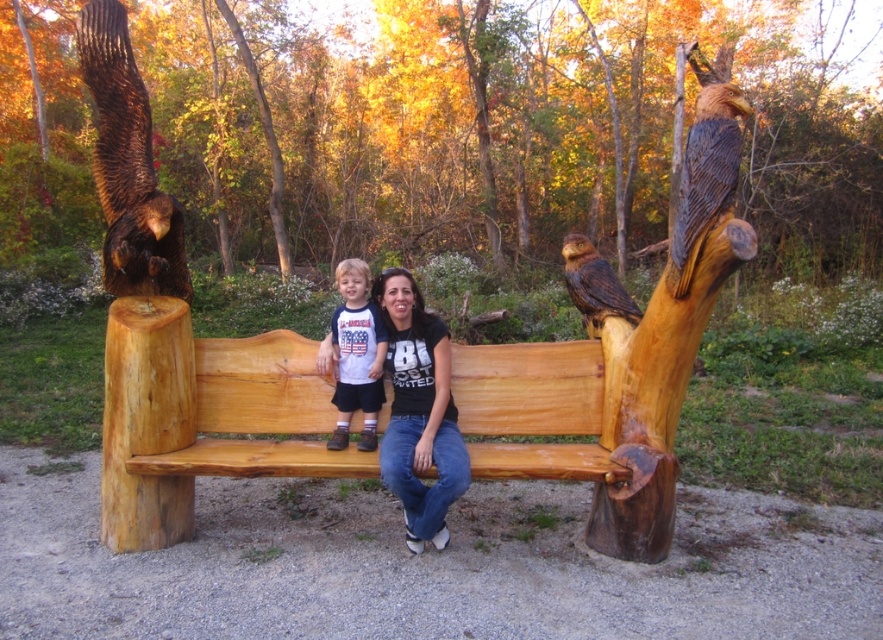
You are a photographer carrying a camera bag that is 90 centimeters long. You are standing at the edge of the park and see the natural wood bench at center and the matte white shirt at center. Can your camera bag fit between them without bending?

A: The natural wood bench at center and the matte white shirt at center are 96.92 centimeters apart from each other. Since your camera bag is 90 centimeters long, it can fit between them without needing to bend.

You are an artist standing in the park and want to sketch the brown wood carving of owl at left. Which direction should you face to capture its position accurately?

The brown wood carving of owl at left is located at point (127, 164), which is to the lower left side of the image. To sketch it accurately, you should face towards the lower left direction.